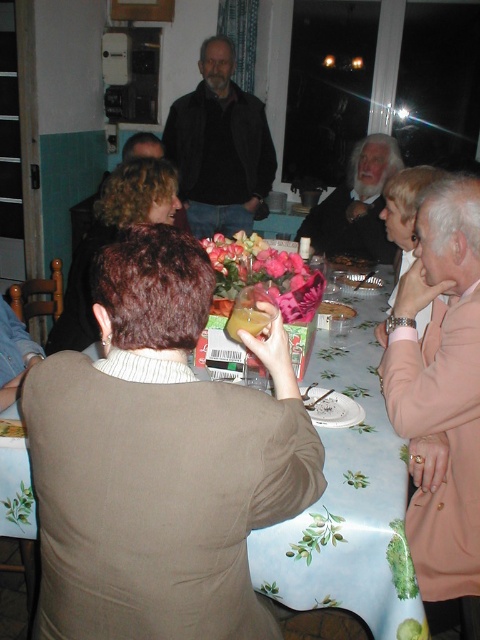
You are a guest at this dinner party and want to grab a snack from the smooth plastic bowl at center without disturbing the person in the pink fabric jacket at right. Can you reach the bowl without moving closer to the jacket?

The pink fabric jacket at right is closer to the viewer than the smooth plastic bowl at center. Therefore, you can reach the smooth plastic bowl at center without moving closer to the jacket, as it is farther away from you.